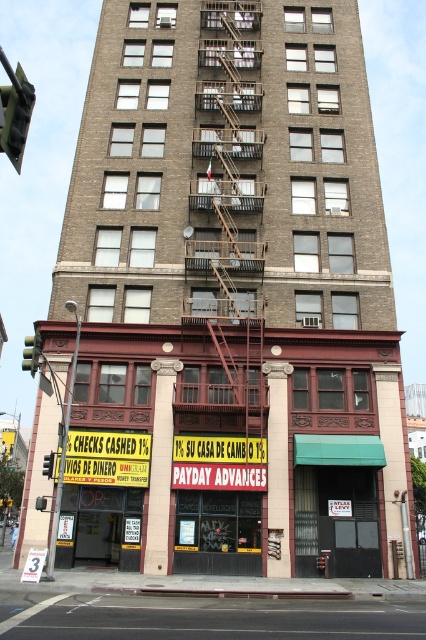
Question: Which object is the farthest from the green plastic traffic light at upper left?

Choices:
 (A) white paper sign at lower left
 (B) yellow plastic traffic light at center
 (C) yellow signboard at center
 (D) brown metal fire escape at center

Answer: (B)

Question: Is green plastic traffic light at upper left smaller than yellow plastic traffic light at center?

Choices:
 (A) yes
 (B) no

Answer: (B)

Question: Which point is farther to the camera?

Choices:
 (A) (249, 298)
 (B) (29, 349)
 (C) (46, 349)

Answer: (A)

Question: Is green plastic traffic light at upper left to the left of white paper sign at lower left from the viewer's perspective?

Choices:
 (A) yes
 (B) no

Answer: (A)

Question: Estimate the real-world distances between objects in this image. Which object is farther from the yellow signboard at center?

Choices:
 (A) green glass traffic light at left
 (B) white paper sign at lower left
 (C) brown metal fire escape at center
 (D) green plastic traffic light at upper left

Answer: (D)

Question: Does green plastic traffic light at upper left appear under yellow plastic traffic light at center?

Choices:
 (A) yes
 (B) no

Answer: (B)